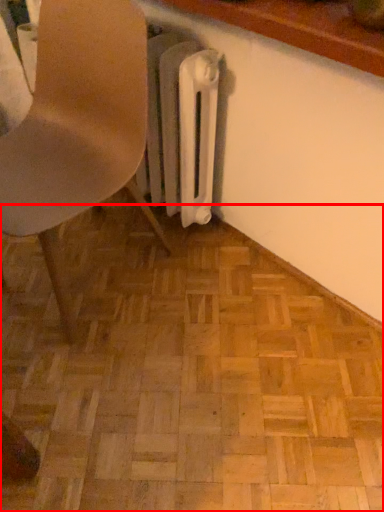
Question: Where is plywood (annotated by the red box) located in relation to chair in the image?

Choices:
 (A) left
 (B) right

Answer: (B)